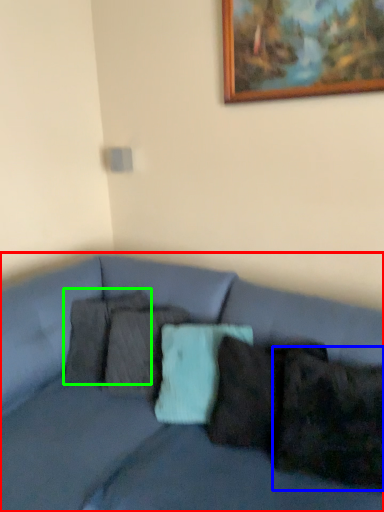
Question: Which is farther away from studio couch (highlighted by a red box)? pillow (highlighted by a blue box) or pillow (highlighted by a green box)?

Choices:
 (A) pillow
 (B) pillow

Answer: (A)